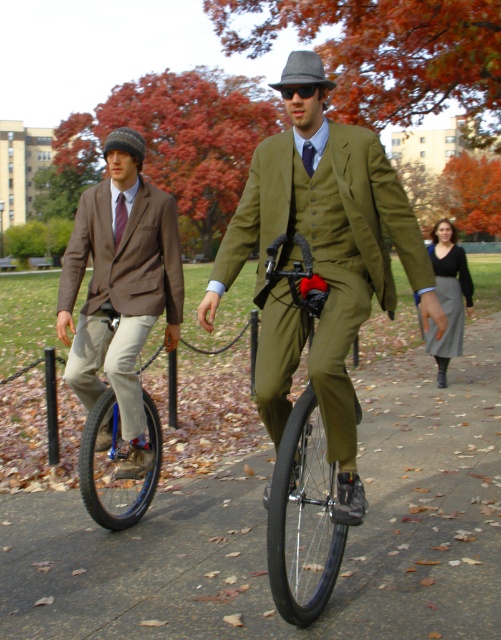
Question: Which of these objects is positioned closest to the matte brown blazer at left?

Choices:
 (A) shiny black unicycle at left
 (B) matte black fedora at center
 (C) gray wool skirt at lower right
 (D) matte olive green monocycle at center

Answer: (A)

Question: Does matte olive green monocycle at center have a larger size compared to gray wool skirt at lower right?

Choices:
 (A) no
 (B) yes

Answer: (A)

Question: Which object is farther from the camera taking this photo?

Choices:
 (A) gray wool skirt at lower right
 (B) matte brown blazer at left
 (C) shiny black unicycle at left

Answer: (A)

Question: Considering the relative positions of matte brown blazer at left and shiny black unicycle at left in the image provided, where is matte brown blazer at left located with respect to shiny black unicycle at left?

Choices:
 (A) above
 (B) below

Answer: (A)

Question: Estimate the real-world distances between objects in this image. Which object is farther from the matte olive green monocycle at center?

Choices:
 (A) matte black fedora at center
 (B) shiny black unicycle at left
 (C) gray wool skirt at lower right
 (D) matte brown blazer at left

Answer: (C)

Question: Is matte olive green monocycle at center positioned behind matte black fedora at center?

Choices:
 (A) no
 (B) yes

Answer: (B)